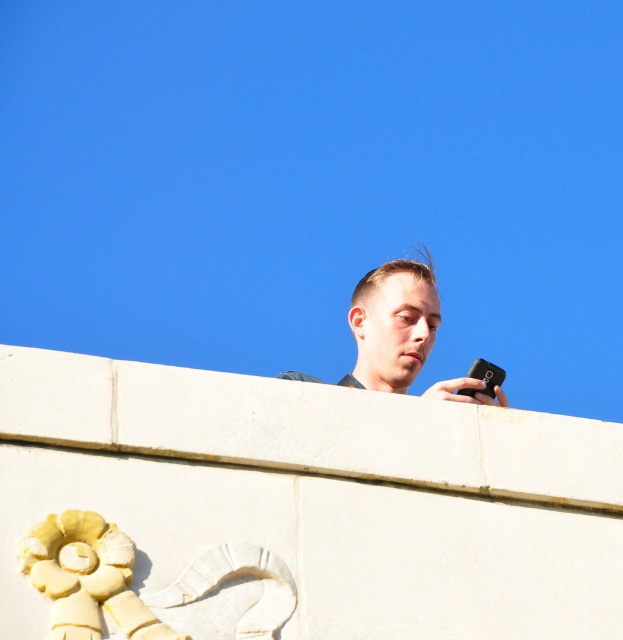
Question: Is matte black phone at upper center thinner than black matte smartphone at upper right?

Choices:
 (A) yes
 (B) no

Answer: (B)

Question: Considering the relative positions of matte black phone at upper center and black matte smartphone at upper right in the image provided, where is matte black phone at upper center located with respect to black matte smartphone at upper right?

Choices:
 (A) above
 (B) below

Answer: (B)

Question: Which of the following is the closest to the observer?

Choices:
 (A) (416, 310)
 (B) (482, 378)

Answer: (B)

Question: Is matte black phone at upper center thinner than black matte smartphone at upper right?

Choices:
 (A) no
 (B) yes

Answer: (A)

Question: Which point is farther from the camera taking this photo?

Choices:
 (A) (487, 369)
 (B) (386, 371)

Answer: (B)